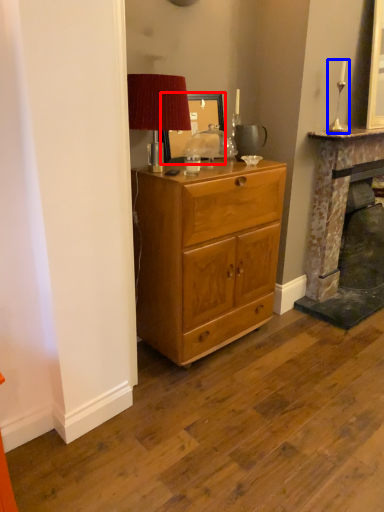
Question: Which point is closer to the camera, picture frame (highlighted by a red box) or candle holder (highlighted by a blue box)?

Choices:
 (A) picture frame
 (B) candle holder

Answer: (A)